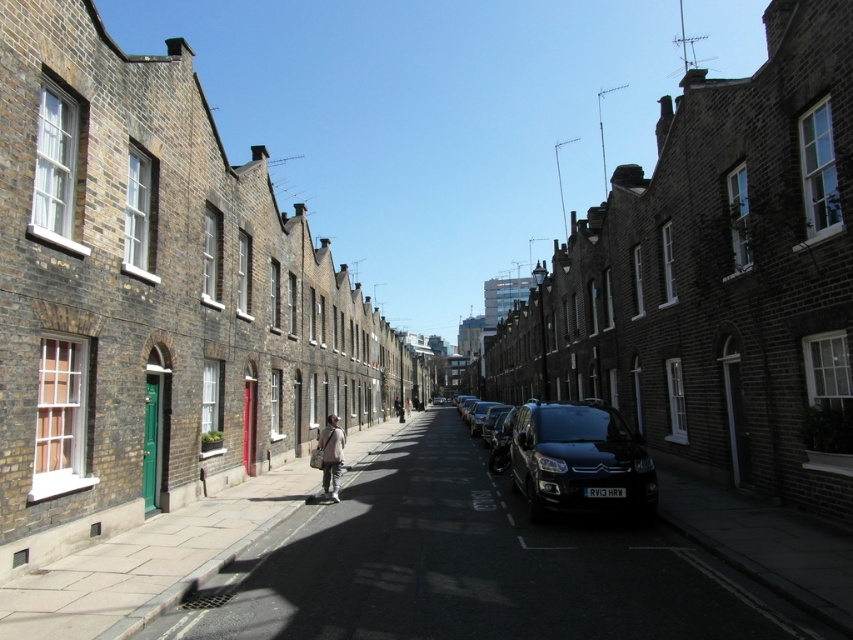
Question: Which point is closer to the camera?

Choices:
 (A) (634, 572)
 (B) (334, 481)
 (C) (583, 417)

Answer: (A)

Question: Is shiny black van at center closer to camera compared to light beige fabric jacket at center?

Choices:
 (A) yes
 (B) no

Answer: (A)

Question: Which object is the closest to the shiny black van at center?

Choices:
 (A) light beige fabric jacket at center
 (B) dark gray concrete pavement at center

Answer: (B)

Question: Which object is farther from the camera taking this photo?

Choices:
 (A) light beige fabric jacket at center
 (B) shiny black van at center
 (C) dark gray concrete pavement at center

Answer: (A)

Question: Considering the relative positions of dark gray concrete pavement at center and light beige fabric jacket at center in the image provided, where is dark gray concrete pavement at center located with respect to light beige fabric jacket at center?

Choices:
 (A) above
 (B) below

Answer: (B)

Question: Does dark gray concrete pavement at center appear over light beige fabric jacket at center?

Choices:
 (A) yes
 (B) no

Answer: (B)